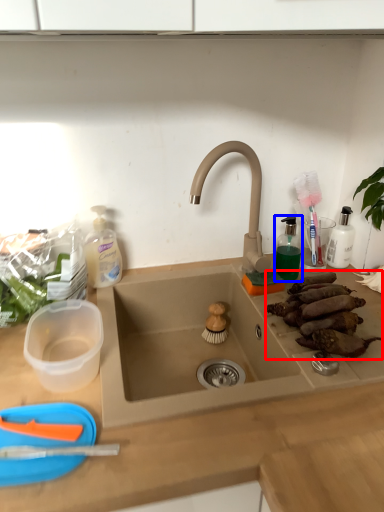
Question: Among these objects, which one is nearest to the camera, food (highlighted by a red box) or toiletry (highlighted by a blue box)?

Choices:
 (A) food
 (B) toiletry

Answer: (A)